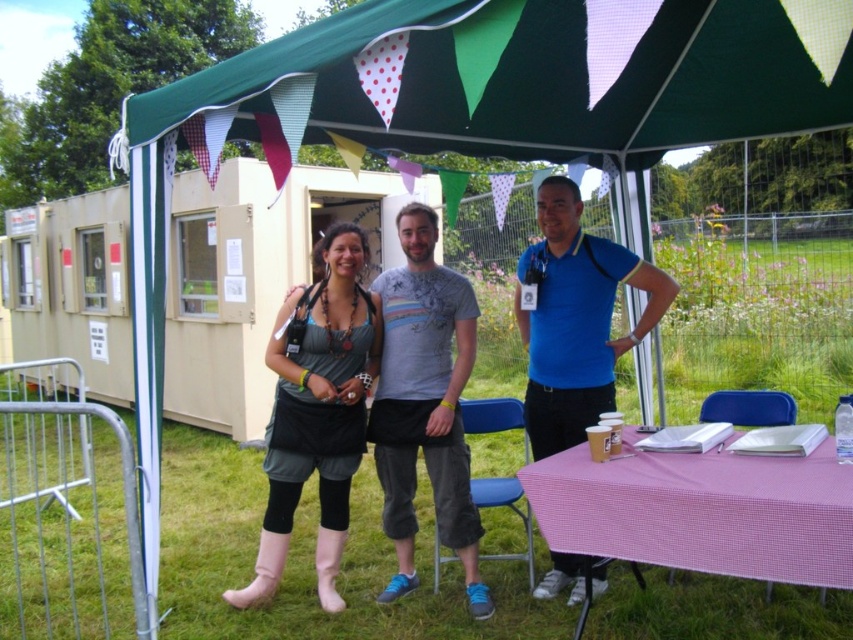
Question: Does pink rubber boots at lower left appear on the left side of gray printed t-shirt at center?

Choices:
 (A) no
 (B) yes

Answer: (B)

Question: Does pink checkered table at lower right appear under blue cotton polo shirt at center?

Choices:
 (A) no
 (B) yes

Answer: (B)

Question: Estimate the real-world distances between objects in this image. Which object is closer to the green fabric canopy at upper center?

Choices:
 (A) blue cotton polo shirt at center
 (B) pink checkered table at lower right
 (C) gray printed t-shirt at center

Answer: (A)

Question: Which point is farther to the camera?

Choices:
 (A) green fabric canopy at upper center
 (B) gray printed t-shirt at center
 (C) pink checkered table at lower right
 (D) blue cotton polo shirt at center

Answer: (D)

Question: Is pink rubber boots at lower left further to camera compared to gray printed t-shirt at center?

Choices:
 (A) no
 (B) yes

Answer: (A)

Question: Which point is closer to the camera taking this photo?

Choices:
 (A) (532, 269)
 (B) (782, 552)
 (C) (410, 413)

Answer: (B)